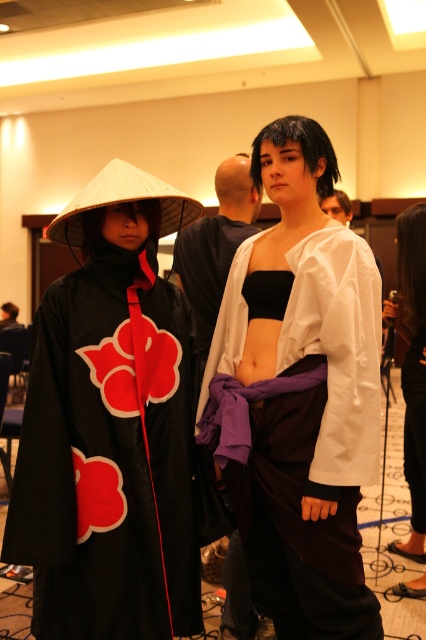
You are a photographer at the convention and want to take a photo focusing on the matte black kimono at center and the matte black pants at center. Which one will appear larger in the photo due to their position?

The matte black kimono at center will appear larger in the photo because it is closer to the viewer than the matte black pants at center.

You are a photographer at the event and need to position the white matte kimono at center and the matte black top at center so that they can both fit within a 1.5 meter wide frame. Can you fit them both side by side without overlapping?

The white matte kimono at center might be wider than matte black top at center, so it is uncertain if they can both fit within the 1.5 meter frame without overlapping. The photographer should check the exact widths to ensure they fit.